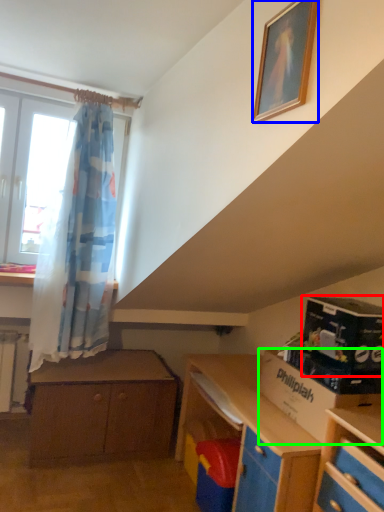
Question: Which object is positioned closest to box (highlighted by a red box)? Select from picture frame (highlighted by a blue box) and cardboard box (highlighted by a green box).

Choices:
 (A) picture frame
 (B) cardboard box

Answer: (B)